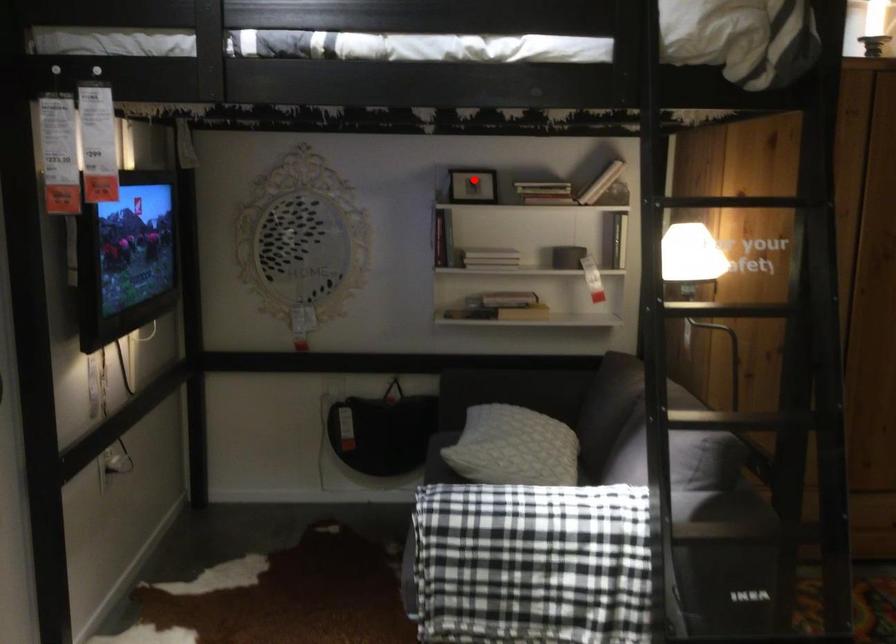
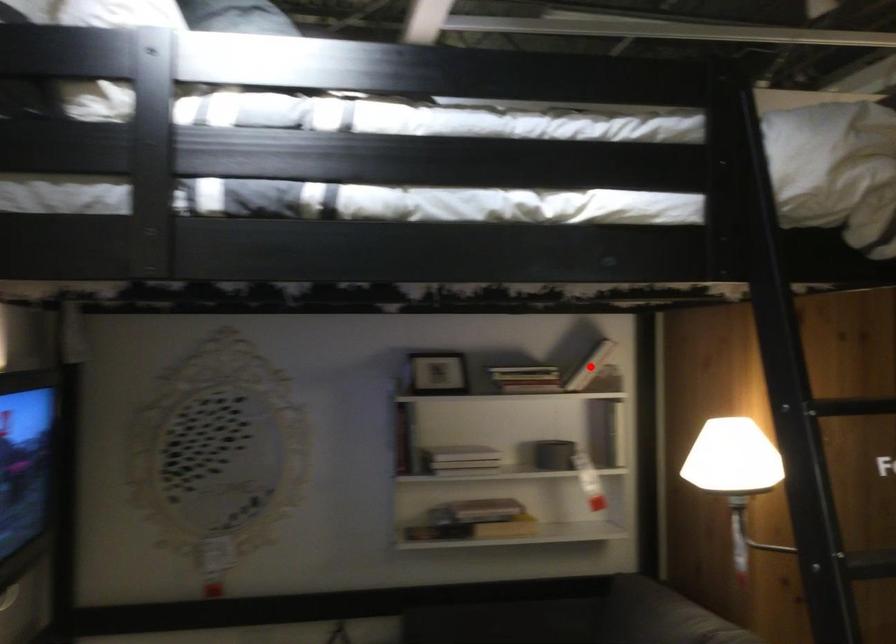
I am providing you with two images of the same scene from different viewpoints. A red point is marked on the first image and another point is marked on the second image. Are the points marked in image1 and image2 representing the same 3D position?

No